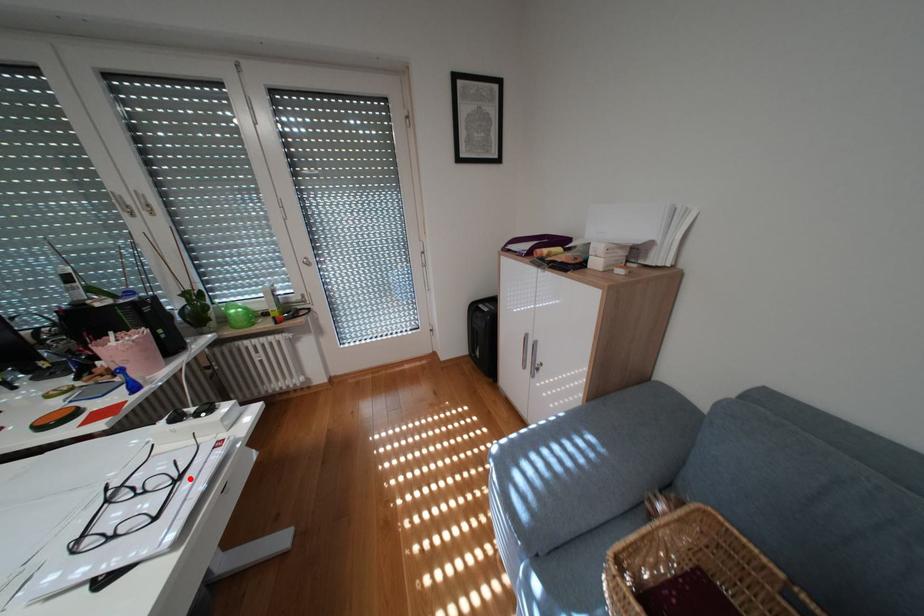
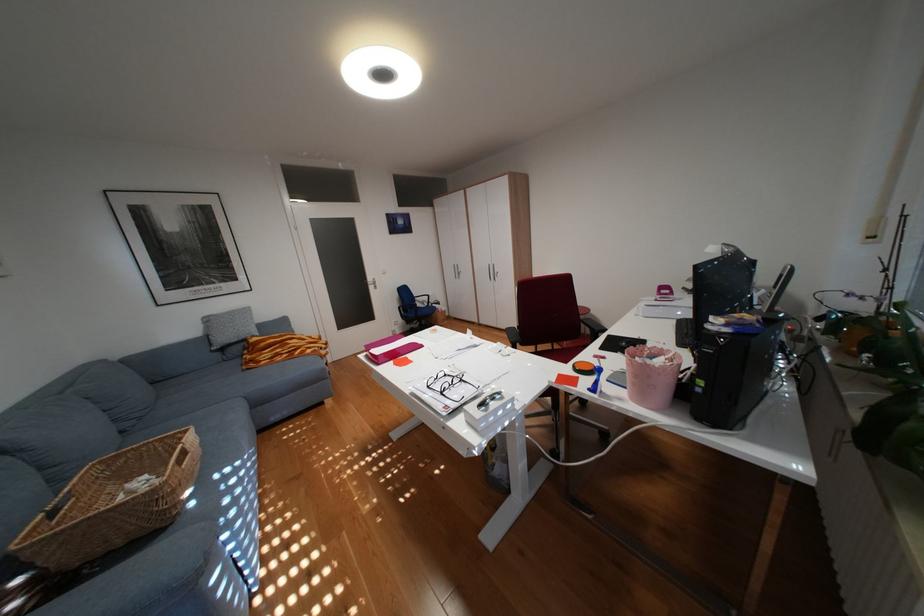
Locate, in the second image, the point that corresponds to the highlighted location in the first image.

(454, 392)